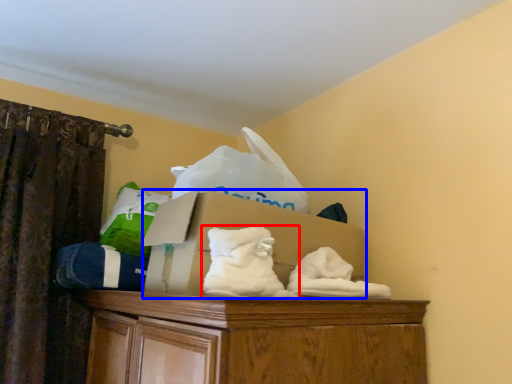
Question: Which point is closer to the camera, sheet (highlighted by a red box) or cardboard box (highlighted by a blue box)?

Choices:
 (A) sheet
 (B) cardboard box

Answer: (A)